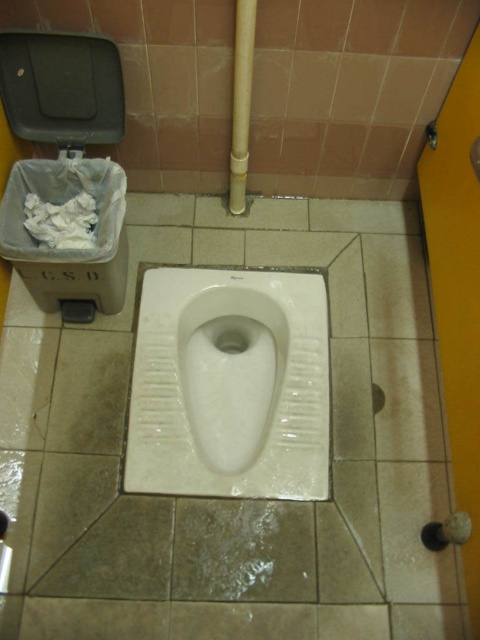
Question: Which point is farther to the camera?

Choices:
 (A) (285, 289)
 (B) (117, 72)

Answer: (A)

Question: Does white glossy toilet bowl at center appear under white fluffy tissue at left?

Choices:
 (A) yes
 (B) no

Answer: (A)

Question: Which object is closer to the camera taking this photo?

Choices:
 (A) black plastic lid at upper left
 (B) white fluffy tissue at left
 (C) white ceramic urinal at center
 (D) white glossy toilet bowl at center

Answer: (A)

Question: Is white glossy toilet bowl at center below white fluffy tissue at left?

Choices:
 (A) no
 (B) yes

Answer: (B)

Question: Can you confirm if black plastic lid at upper left is wider than white fluffy tissue at left?

Choices:
 (A) no
 (B) yes

Answer: (B)

Question: Which is farther from the white fluffy tissue at left?

Choices:
 (A) white ceramic urinal at center
 (B) black plastic lid at upper left

Answer: (A)